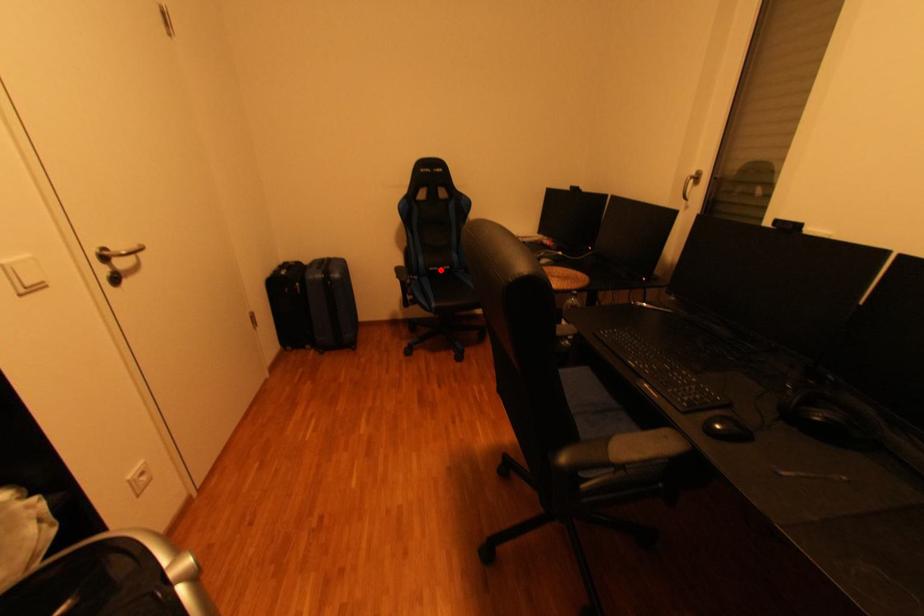
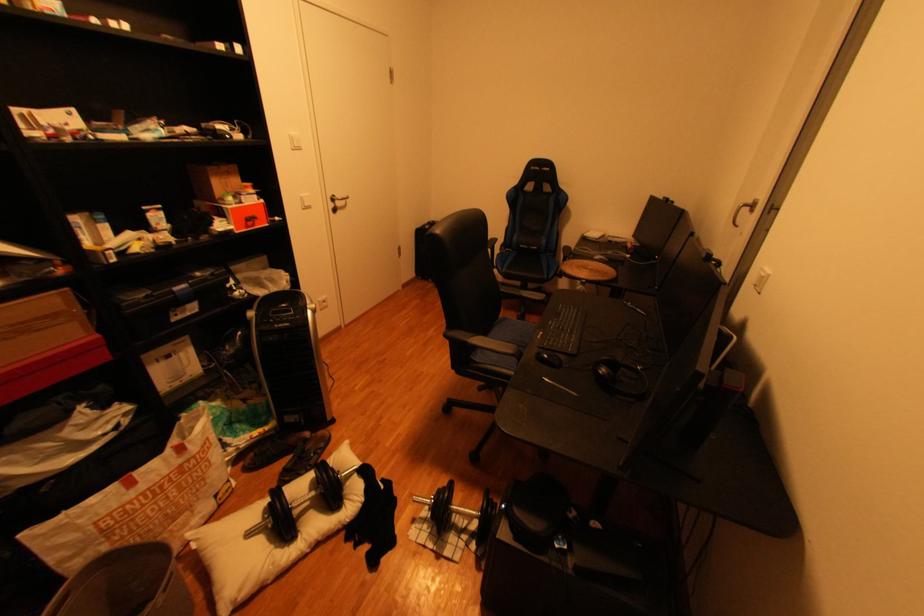
Locate, in the second image, the point that corresponds to the highlighted location in the first image.

(531, 246)